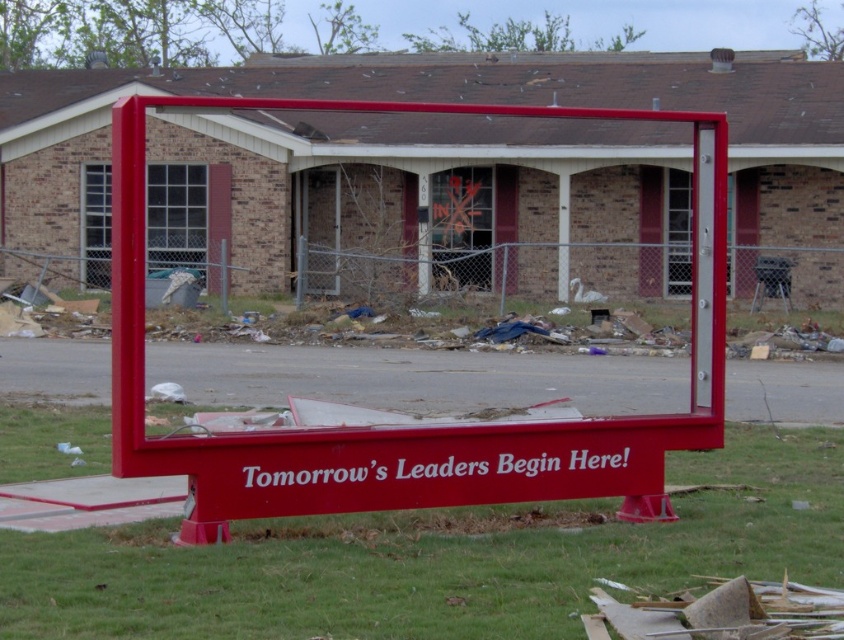
Does green grass at lower center appear under red matte sign at center?

Yes.

Can you confirm if green grass at lower center is shorter than red matte sign at center?

Yes, green grass at lower center is shorter than red matte sign at center.

Where is `green grass at lower center`? The image size is (844, 640). green grass at lower center is located at coordinates (437, 560).